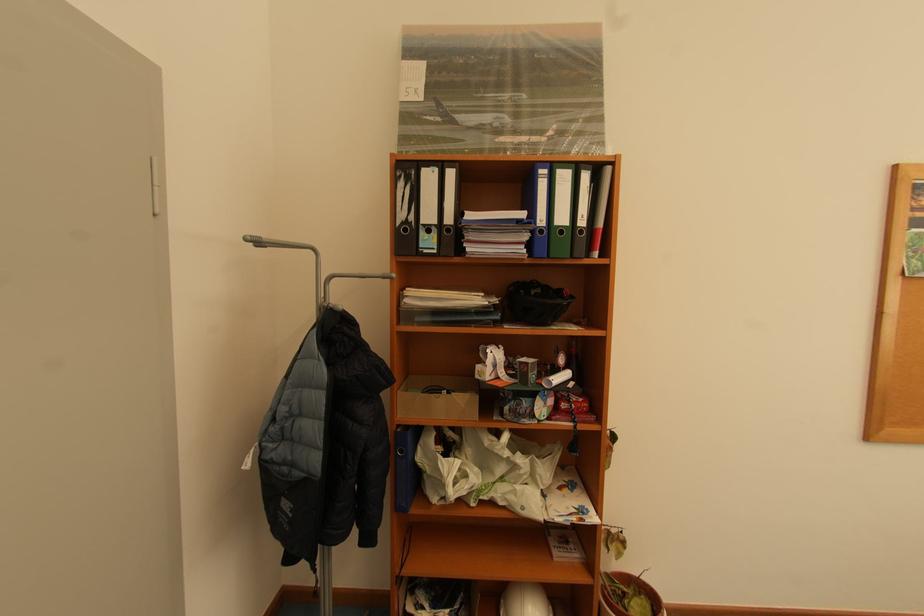
What do you see at coordinates (527, 371) in the screenshot?
I see `the blue and white mug` at bounding box center [527, 371].